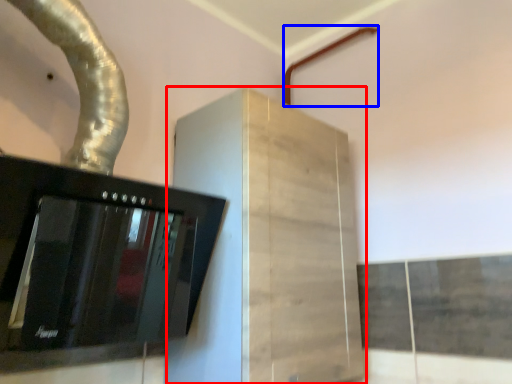
Question: Among these objects, which one is farthest to the camera, cabinetry (highlighted by a red box) or pipe (highlighted by a blue box)?

Choices:
 (A) cabinetry
 (B) pipe

Answer: (B)